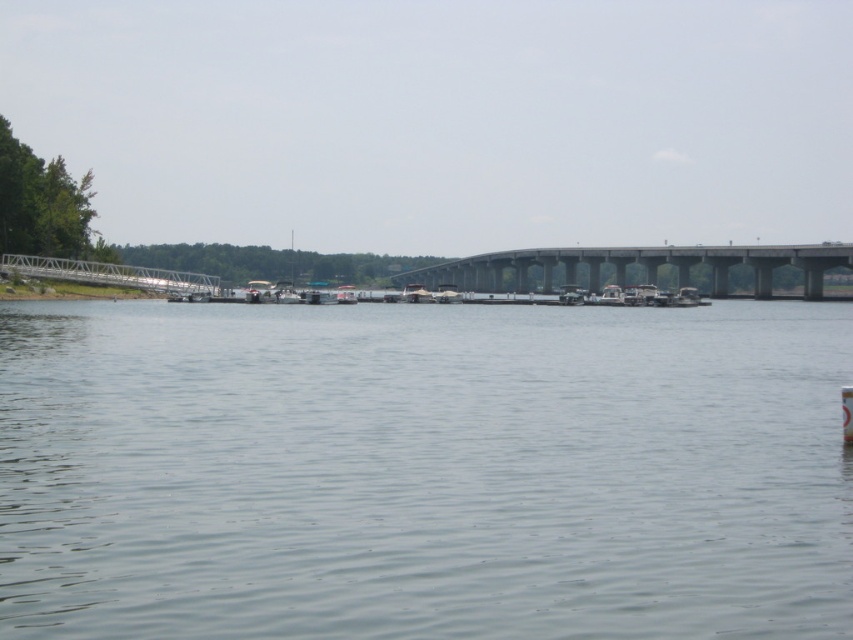
From the picture: You are standing on the metal walkway on the left side of the image and want to reach the gray concrete bridge at center. Which direction should you head towards to avoid the gray smooth water at center?

To avoid the gray smooth water at center, you should head towards the right side since the gray concrete bridge at center is positioned to the right of the gray smooth water at center.

You are standing on the metal walkway on the left side of the image and want to reach the point marked at coordinates point (422, 470). Which direction should you walk to get there from the metal walkway?

You should walk towards the center of the image because the point (422, 470) is located on gray smooth water at center, which is the direction opposite to the metal walkway on the left side.